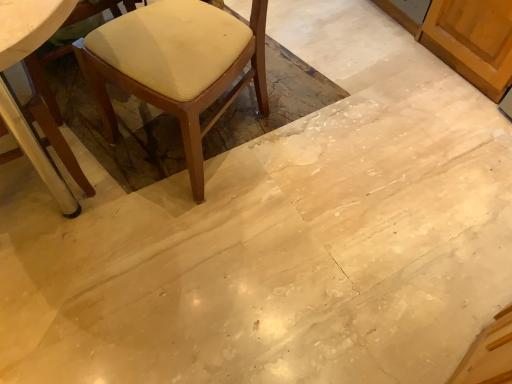
Question: Is matte beige cushioned chair at left, arranged as the first chair when viewed from the right, thinner than wooden chair at left, the 1th chair when ordered from left to right?

Choices:
 (A) yes
 (B) no

Answer: (B)

Question: Is matte beige cushioned chair at left, the second chair positioned from the left, behind wooden chair at left, which is the 2th chair in right-to-left order?

Choices:
 (A) no
 (B) yes

Answer: (B)

Question: Is matte beige cushioned chair at left, the second chair positioned from the left, far from wooden chair at left, the 1th chair when ordered from left to right?

Choices:
 (A) yes
 (B) no

Answer: (B)

Question: Is wooden chair at left, which is the 2th chair in right-to-left order, at the back of matte beige cushioned chair at left, the second chair positioned from the left?

Choices:
 (A) yes
 (B) no

Answer: (B)

Question: Does matte beige cushioned chair at left, arranged as the first chair when viewed from the right, have a lesser height compared to wooden chair at left, which is the 2th chair in right-to-left order?

Choices:
 (A) yes
 (B) no

Answer: (B)

Question: Can you confirm if matte beige cushioned chair at left, arranged as the first chair when viewed from the right, is taller than wooden chair at left, the 1th chair when ordered from left to right?

Choices:
 (A) no
 (B) yes

Answer: (B)

Question: Can you confirm if wooden chair at left, the 1th chair when ordered from left to right, is positioned to the right of matte beige cushioned chair at left, the second chair positioned from the left?

Choices:
 (A) yes
 (B) no

Answer: (B)

Question: Does wooden chair at left, which is the 2th chair in right-to-left order, have a smaller size compared to matte beige cushioned chair at left, the second chair positioned from the left?

Choices:
 (A) yes
 (B) no

Answer: (A)

Question: Is wooden chair at left, the 1th chair when ordered from left to right, outside of matte beige cushioned chair at left, arranged as the first chair when viewed from the right?

Choices:
 (A) yes
 (B) no

Answer: (A)

Question: Is wooden chair at left, the 1th chair when ordered from left to right, behind matte beige cushioned chair at left, arranged as the first chair when viewed from the right?

Choices:
 (A) no
 (B) yes

Answer: (A)

Question: Does wooden chair at left, which is the 2th chair in right-to-left order, appear on the left side of matte beige cushioned chair at left, the second chair positioned from the left?

Choices:
 (A) no
 (B) yes

Answer: (B)

Question: From the image's perspective, is wooden chair at left, which is the 2th chair in right-to-left order, under matte beige cushioned chair at left, the second chair positioned from the left?

Choices:
 (A) yes
 (B) no

Answer: (A)

Question: Would you say matte beige cushioned chair at left, the second chair positioned from the left, is to the left or to the right of wooden chair at left, which is the 2th chair in right-to-left order, in the picture?

Choices:
 (A) right
 (B) left

Answer: (A)